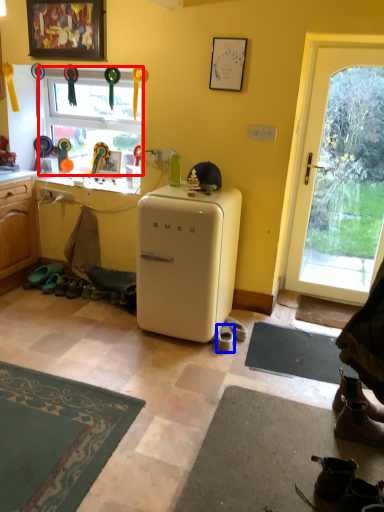
Question: Which point is further to the camera, window (highlighted by a red box) or footwear (highlighted by a blue box)?

Choices:
 (A) window
 (B) footwear

Answer: (A)